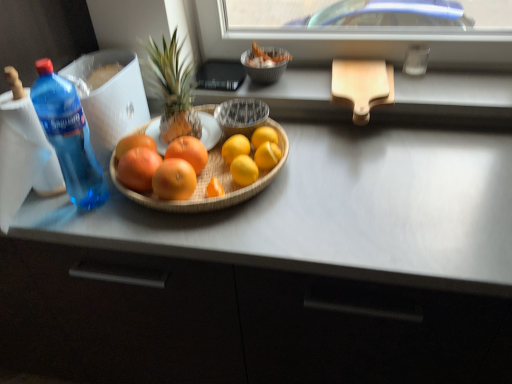
You are a GUI agent. You are given a task and a screenshot of the screen. Output one action in this format:
    pyautogui.click(x=<x>, y=<y>)
    Task: Click on the free space to the right of yellow matte grapefruit at center, which is the fifth grapefruit in left-to-right order
    The image size is (512, 384).
    Given the screenshot: What is the action you would take?
    pyautogui.click(x=315, y=183)